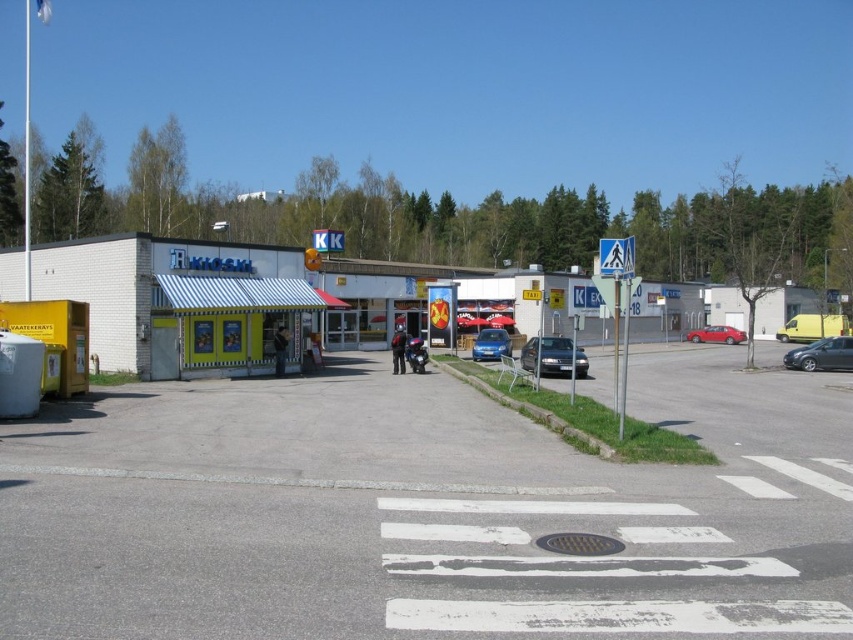
Can you confirm if asphalt at center is wider than red matte car at center?

Indeed, asphalt at center has a greater width compared to red matte car at center.

Does asphalt at center have a greater height compared to red matte car at center?

Incorrect, asphalt at center's height is not larger of red matte car at center's.

Locate an element on the screen. The width and height of the screenshot is (853, 640). asphalt at center is located at coordinates (427, 512).

Identify the location of asphalt at center. (427, 512).

The height and width of the screenshot is (640, 853). What do you see at coordinates (491, 344) in the screenshot?
I see `blue metallic car at center` at bounding box center [491, 344].

Does point (479, 340) come farther from viewer compared to point (706, 333)?

No, (479, 340) is in front of (706, 333).

Where is `blue metallic car at center`? The width and height of the screenshot is (853, 640). blue metallic car at center is located at coordinates (491, 344).

Who is lower down, satin black sedan at center or silver metallic hatchback at lower right?

Positioned lower is silver metallic hatchback at lower right.

Between satin black sedan at center and silver metallic hatchback at lower right, which one is positioned higher?

satin black sedan at center

Image resolution: width=853 pixels, height=640 pixels. Identify the location of satin black sedan at center. (547, 355).